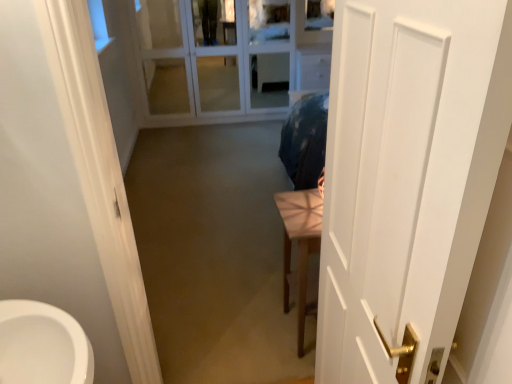
I want to click on vacant region above light brown wooden table at center (from a real-world perspective), so click(x=297, y=206).